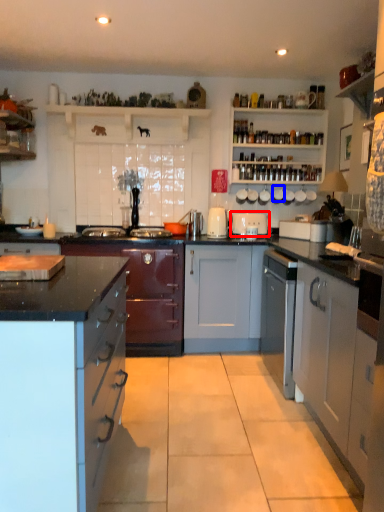
Question: Which point is closer to the camera, appliance (highlighted by a red box) or appliance (highlighted by a blue box)?

Choices:
 (A) appliance
 (B) appliance

Answer: (A)